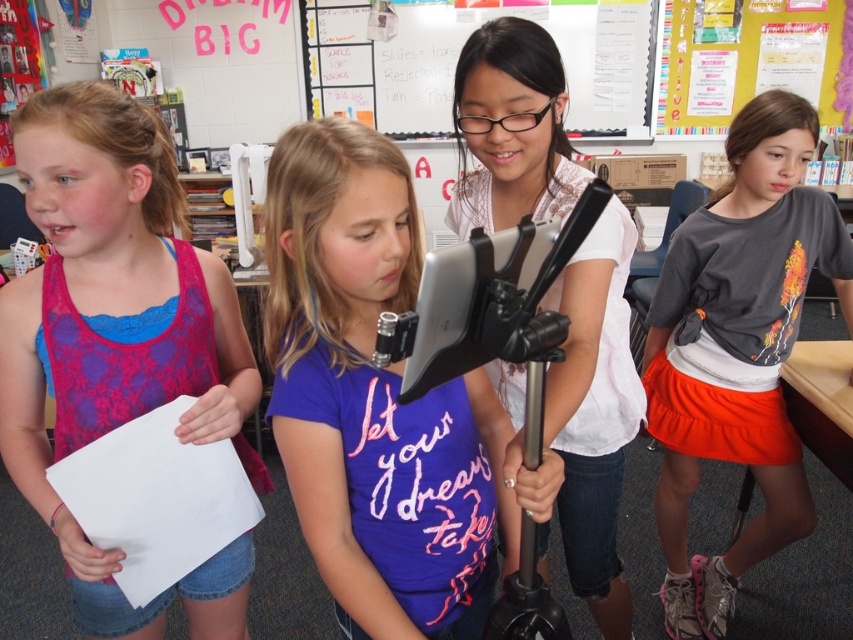
Question: Among these points, which one is nearest to the camera?

Choices:
 (A) (68, 298)
 (B) (448, 595)
 (C) (618, 596)
 (D) (784, 422)

Answer: (B)

Question: Does gray cotton shirt at center have a smaller size compared to whiteboard at upper center?

Choices:
 (A) no
 (B) yes

Answer: (B)

Question: Which object is positioned farthest from the purple matte shirt at center?

Choices:
 (A) gray cotton shirt at center
 (B) pink lace tank top at left
 (C) whiteboard at upper center

Answer: (C)

Question: Is white lace shirt at center to the left of whiteboard at upper center from the viewer's perspective?

Choices:
 (A) no
 (B) yes

Answer: (B)

Question: Can you confirm if gray cotton shirt at center is smaller than whiteboard at upper center?

Choices:
 (A) yes
 (B) no

Answer: (A)

Question: Which point is farther to the camera?

Choices:
 (A) (386, 426)
 (B) (76, 356)
 (C) (757, 179)

Answer: (C)